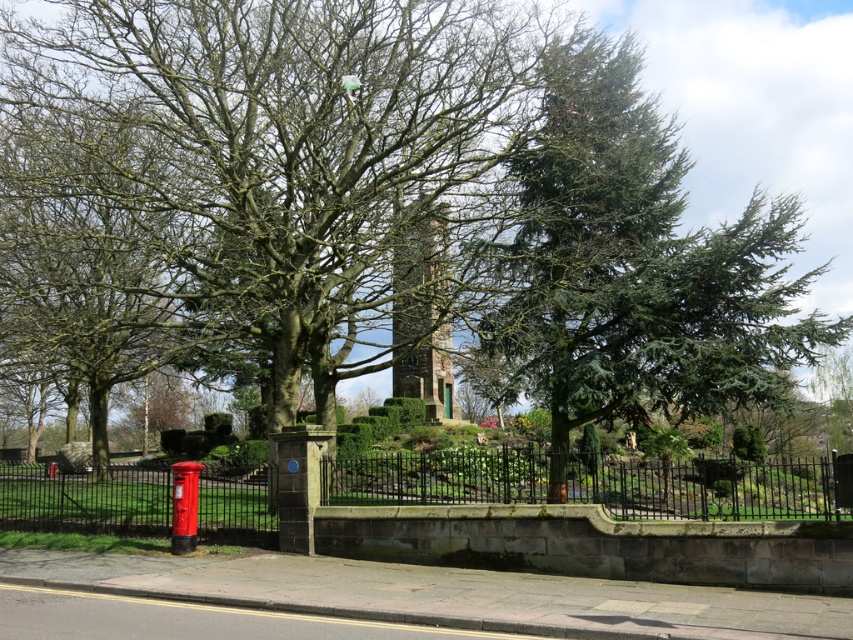
Question: Which point is farther from the camera taking this photo?

Choices:
 (A) click(759, 513)
 (B) click(94, 179)

Answer: (A)

Question: Which point appears farthest from the camera in this image?

Choices:
 (A) (815, 476)
 (B) (469, 192)

Answer: (A)

Question: Based on their relative distances, which object is nearer to the green needle-like tree at upper right?

Choices:
 (A) green textured tree at center
 (B) glossy metal fence at lower center

Answer: (A)

Question: Is green needle-like tree at upper right smaller than glossy metal fence at lower center?

Choices:
 (A) no
 (B) yes

Answer: (A)

Question: Can you confirm if green textured tree at center is smaller than glossy metal fence at lower center?

Choices:
 (A) no
 (B) yes

Answer: (B)

Question: Does green textured tree at center have a larger size compared to green needle-like tree at upper right?

Choices:
 (A) no
 (B) yes

Answer: (A)